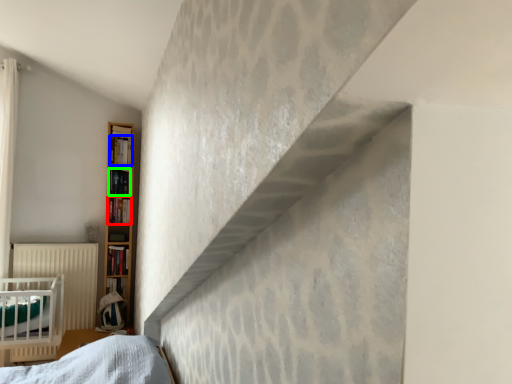
Question: Which object is positioned closest to book (highlighted by a red box)? Select from book (highlighted by a blue box) and book (highlighted by a green box).

Choices:
 (A) book
 (B) book

Answer: (B)